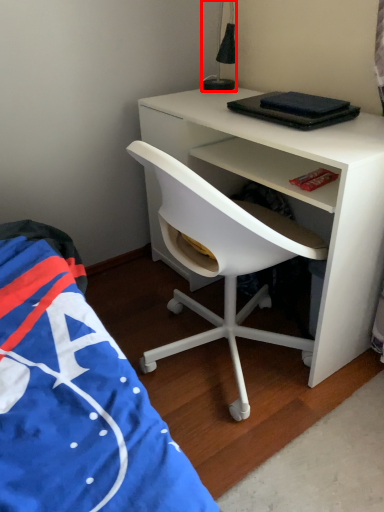
Question: From the image's perspective, what is the correct spatial relationship of lamp (annotated by the red box) in relation to chair?

Choices:
 (A) above
 (B) below

Answer: (A)